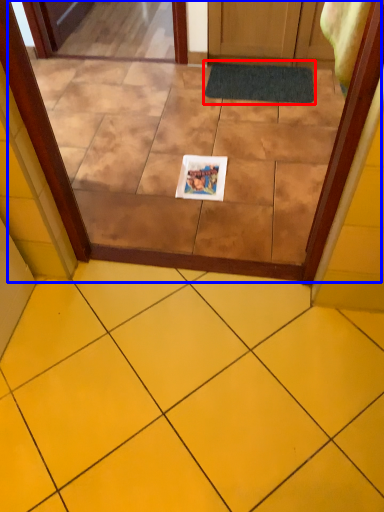
Question: Which object appears farthest to the camera in this image, bath mat (highlighted by a red box) or glass door (highlighted by a blue box)?

Choices:
 (A) bath mat
 (B) glass door

Answer: (A)